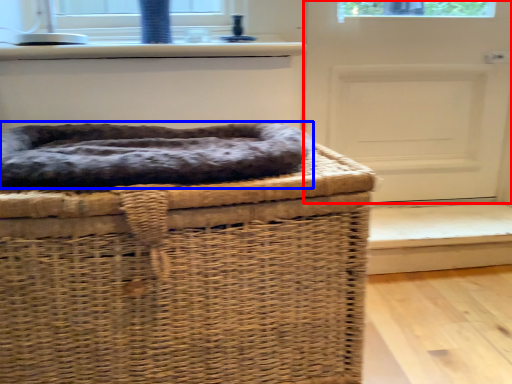
Question: Which point is further to the camera, door (highlighted by a red box) or dog bed (highlighted by a blue box)?

Choices:
 (A) door
 (B) dog bed

Answer: (A)